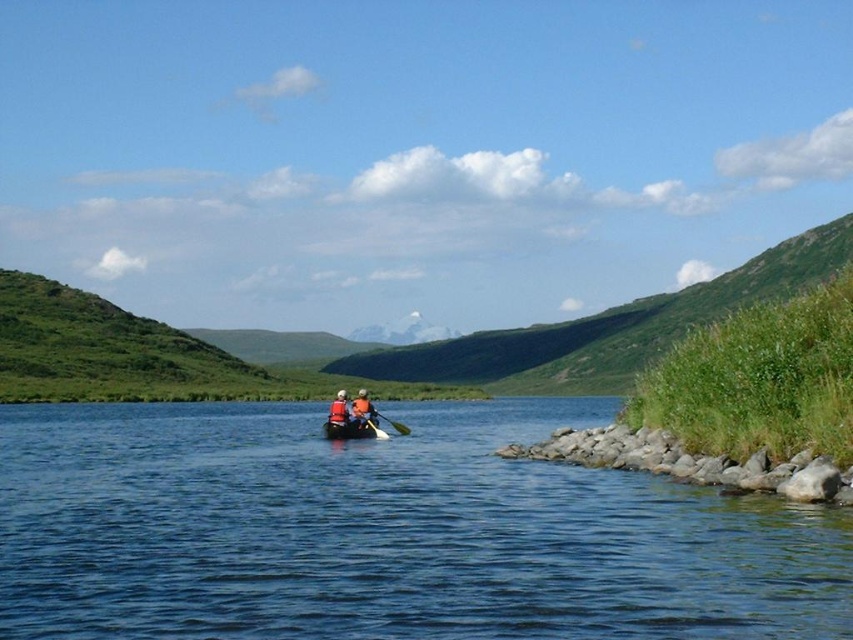
Question: Observing the image, what is the correct spatial positioning of white plastic canoe at center in reference to orange life jacket at center?

Choices:
 (A) left
 (B) right

Answer: (B)

Question: Which of the following is the closest to the observer?

Choices:
 (A) orange life vest at center
 (B) black plastic paddle at center

Answer: (A)

Question: Which of the following is the closest to the observer?

Choices:
 (A) (337, 438)
 (B) (381, 432)

Answer: (A)

Question: Which point is farther to the camera?

Choices:
 (A) orange life jacket at center
 (B) orange life vest at center
 (C) blue water at center

Answer: (B)

Question: Does white plastic canoe at center have a lesser width compared to wooden paddle at center?

Choices:
 (A) no
 (B) yes

Answer: (A)

Question: In this image, where is blue water at center located relative to orange life vest at center?

Choices:
 (A) left
 (B) right

Answer: (A)